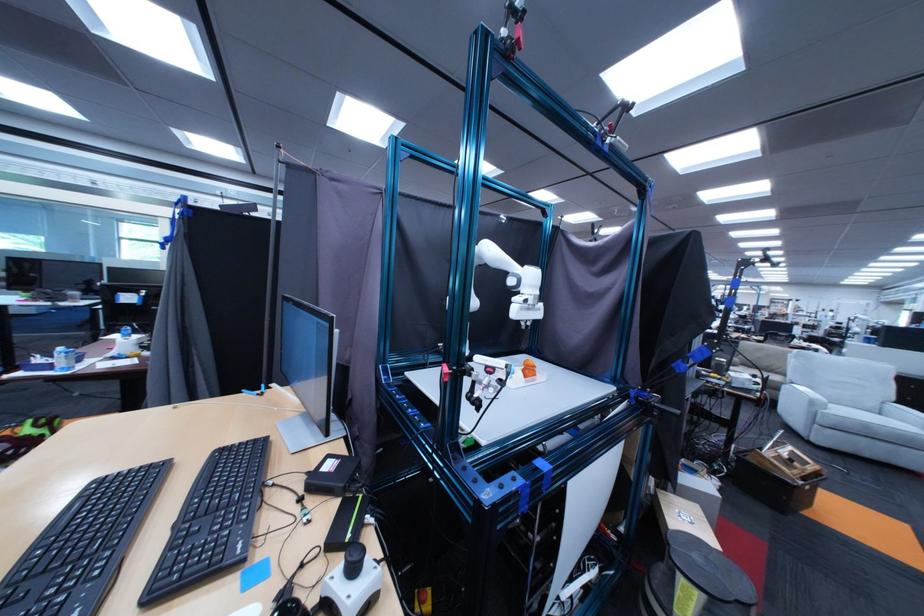
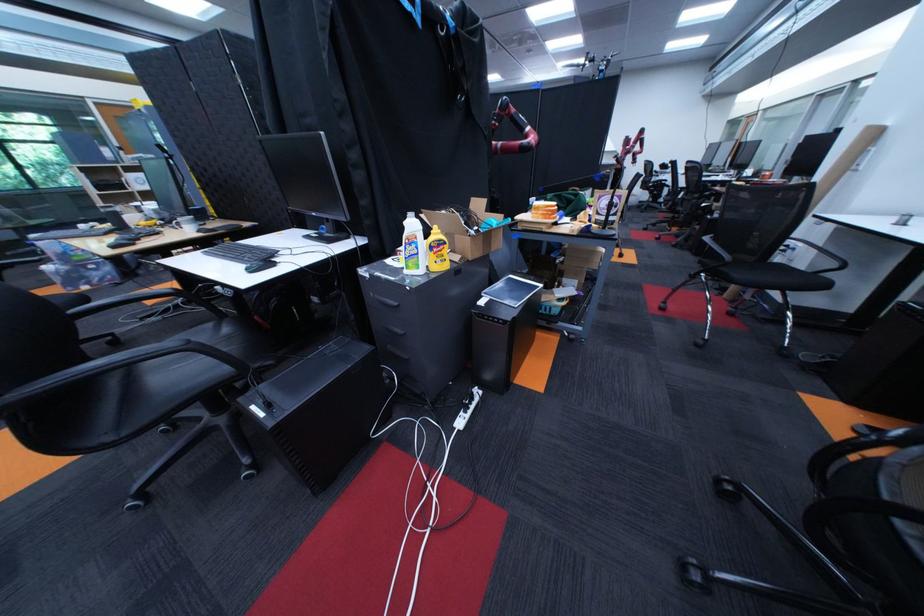
Question: I am providing you with two images of the same scene from different viewpoints. Which of the following objects are not visible in image2?

Choices:
 (A) double light switch
 (B) PC power button
 (C) orange printed object
 (D) grey drawer handle

Answer: (C)